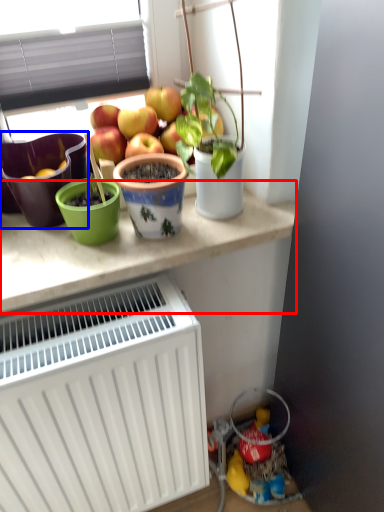
Question: Among these objects, which one is farthest to the camera, table (highlighted by a red box) or flowerpot (highlighted by a blue box)?

Choices:
 (A) table
 (B) flowerpot

Answer: (B)